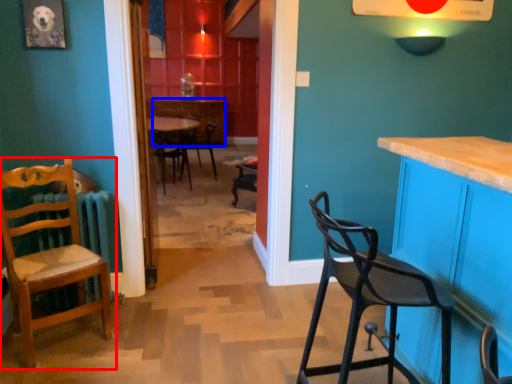
Question: Which point is closer to the camera, chair (highlighted by a red box) or table (highlighted by a blue box)?

Choices:
 (A) chair
 (B) table

Answer: (A)